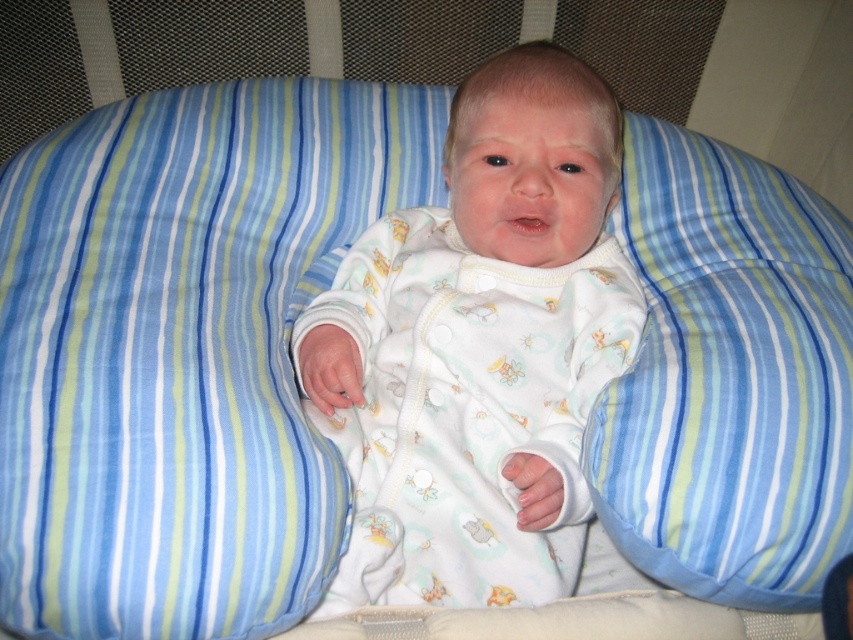
Question: Which point appears closest to the camera in this image?

Choices:
 (A) (415, 346)
 (B) (839, 516)

Answer: (B)

Question: Does white soft fabric baby at center come behind blue striped pillow at center?

Choices:
 (A) yes
 (B) no

Answer: (A)

Question: Can you confirm if white soft fabric baby at center is thinner than blue striped pillow at center?

Choices:
 (A) no
 (B) yes

Answer: (A)

Question: Among these objects, which one is farthest from the camera?

Choices:
 (A) blue striped pillow at center
 (B) white soft fabric baby at center

Answer: (B)

Question: Where is white soft fabric baby at center located in relation to blue striped pillow at center in the image?

Choices:
 (A) left
 (B) right

Answer: (A)

Question: Which of the following is the closest to the observer?

Choices:
 (A) [438, 285]
 (B) [817, 348]

Answer: (B)